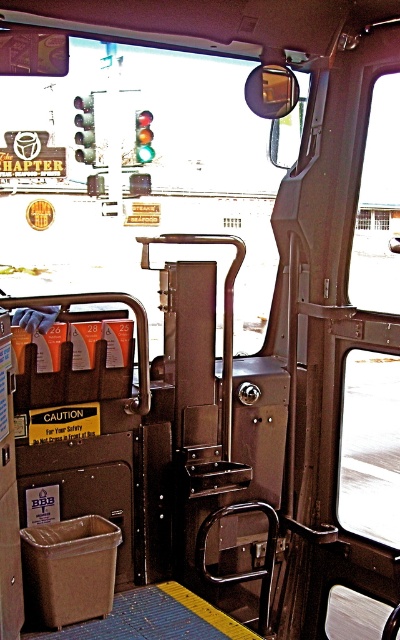
You are a passenger on the bus looking forward. You see the green glass traffic light at upper center and the glassy red traffic light at upper center. Which traffic light is positioned to the left?

The green glass traffic light at upper center is positioned to the left of the glassy red traffic light at upper center.

You are standing at the back of the bus and want to reach the front. There are two points marked on the bus floor, point (81, 148) and point (137, 161). Which point is closer to your current position?

Point (81, 148) is closer to the viewer than point (137, 161), so it is closer to your current position at the back of the bus.

You are a passenger on the bus and want to know the exact position of the green glass traffic light at upper center in the image. What are its coordinates?

The green glass traffic light at upper center is located at coordinates point [84,129].